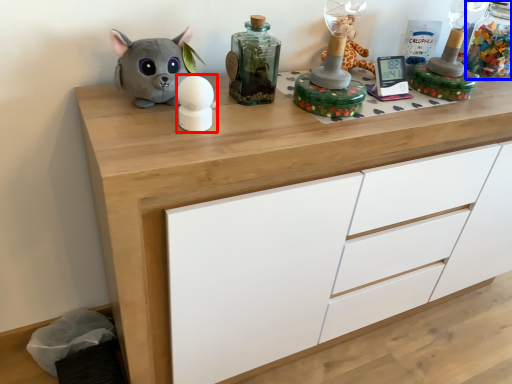
Question: Which object is further to the camera taking this photo, toy (highlighted by a red box) or bottle (highlighted by a blue box)?

Choices:
 (A) toy
 (B) bottle

Answer: (B)